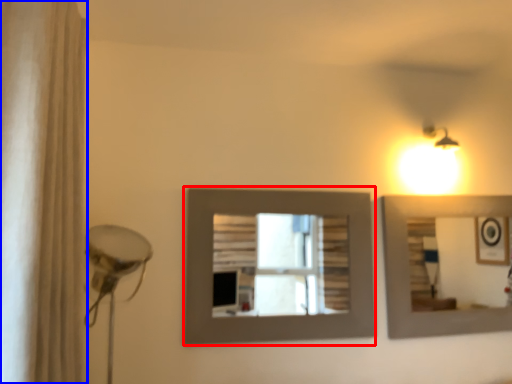
Question: Which object appears closest to the camera in this image, picture frame (highlighted by a red box) or shower curtain (highlighted by a blue box)?

Choices:
 (A) picture frame
 (B) shower curtain

Answer: (B)